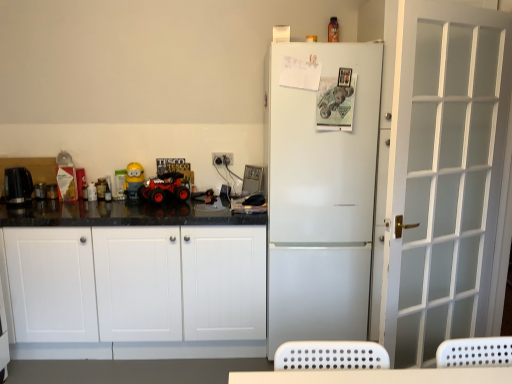
At what (x,y) coordinates should I click in order to perform the action: click on unoccupied region to the right of black plastic kettle at left, the 1th appliance positioned from the front. Please return your answer as a coordinate pair (x, y). This screenshot has width=512, height=384. Looking at the image, I should click on (48, 204).